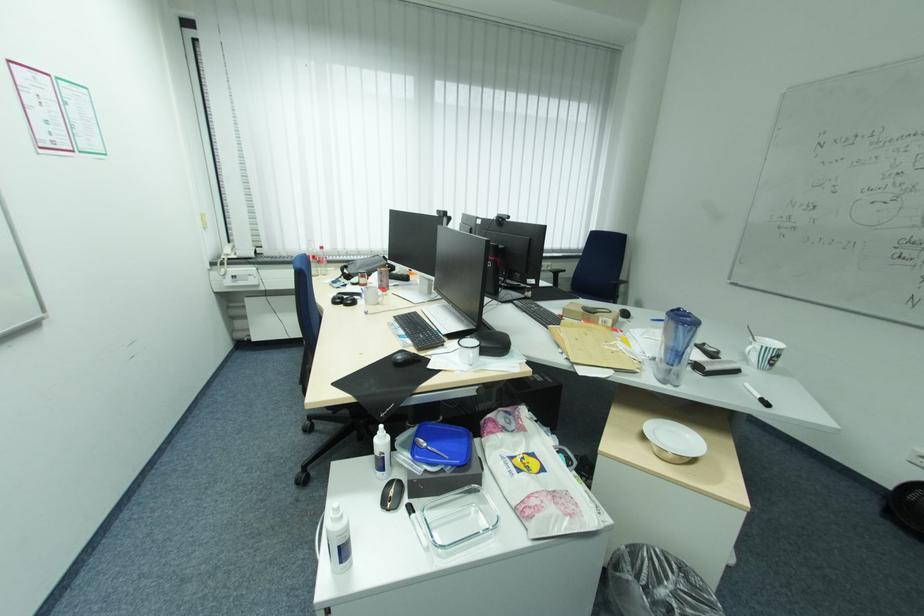
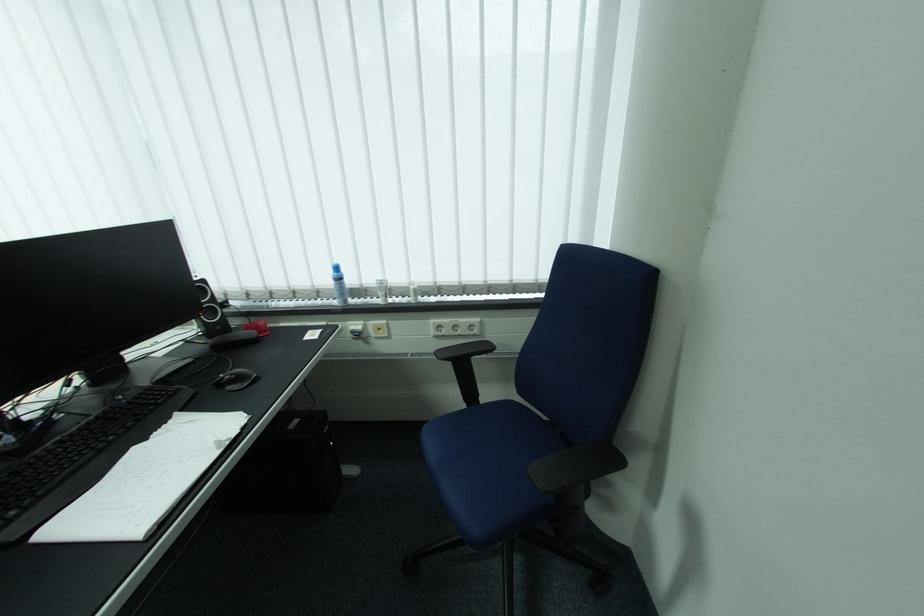
In a continuous first-person perspective shot, in which direction is the camera moving?

The cameraman walked toward right, forward.